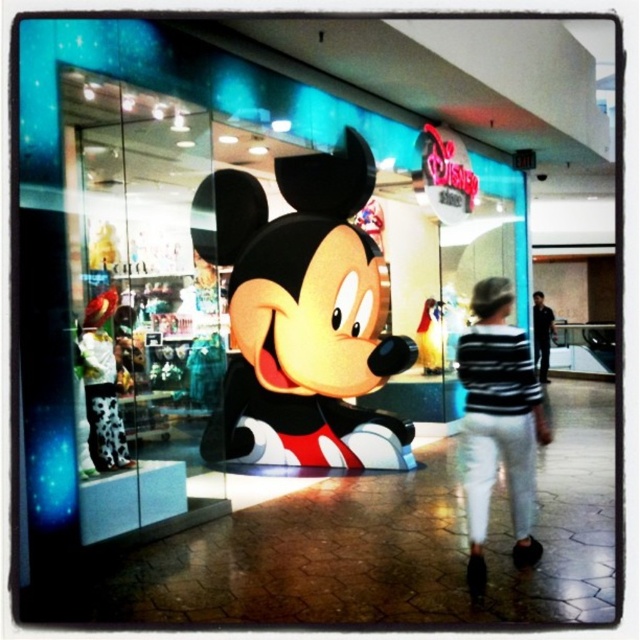
You are a customer in the store and want to pick up the cow print fabric boot at lower left. Is the matte plastic mickey mouse at center blocking your access to it?

The matte plastic mickey mouse at center is positioned over the cow print fabric boot at lower left, so it is blocking access to it.

You are a store employee who needs to place a new display. The matte plastic mickey mouse at center and the striped sweater at center are both in the center. Which item takes up more horizontal space?

The matte plastic mickey mouse at center has a larger width than the striped sweater at center, so it takes up more horizontal space.

You are standing at the entrance of the Disney store and want to find the matte plastic mickey mouse at center. According to the store layout, where should you look to find it?

The matte plastic mickey mouse at center is located at point (301, 316), which is near the center of the store entrance. Look there to find it.